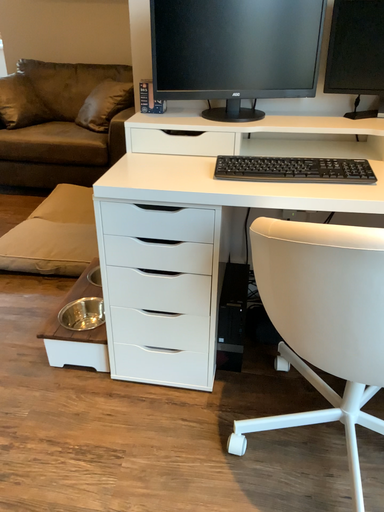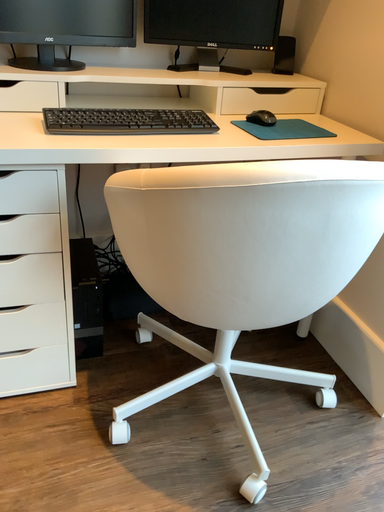
Question: Which way did the camera rotate in the video?

Choices:
 (A) rotated right
 (B) rotated left

Answer: (A)